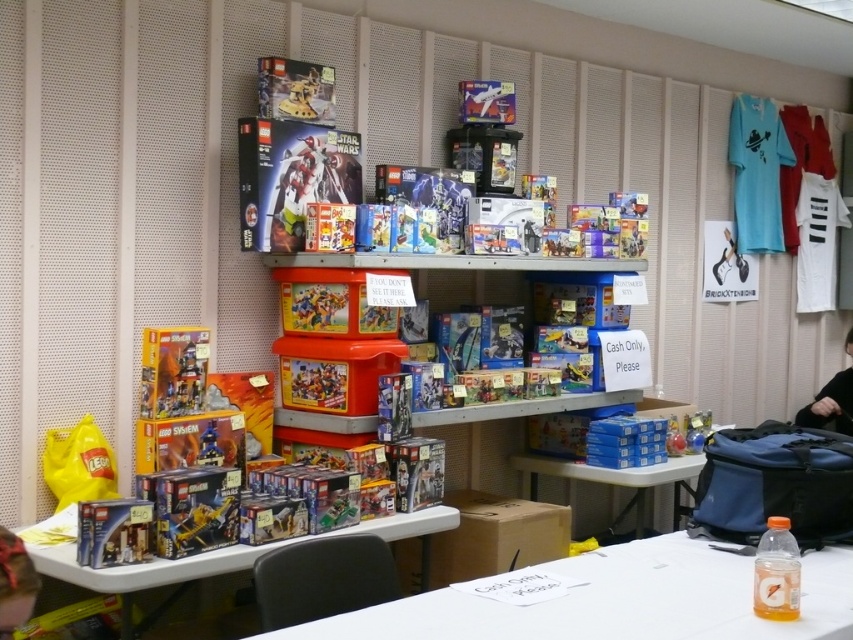
Question: Does blue cardboard boxes at center have a larger size compared to matte black hair at lower left?

Choices:
 (A) no
 (B) yes

Answer: (B)

Question: Which point is farther to the camera?

Choices:
 (A) (451, 625)
 (B) (569, 481)

Answer: (B)

Question: Is the position of matte plastic storage bin at center more distant than that of matte black hair at lower left?

Choices:
 (A) yes
 (B) no

Answer: (A)

Question: Which object appears closest to the camera in this image?

Choices:
 (A) matte black robot at upper center
 (B) matte plastic storage bin at center

Answer: (B)

Question: Does matte black robot at upper center have a greater width compared to translucent plastic minifigure at center?

Choices:
 (A) yes
 (B) no

Answer: (A)

Question: Which point is farther to the camera?

Choices:
 (A) translucent plastic minifigure at center
 (B) matte black robot at upper center

Answer: (B)